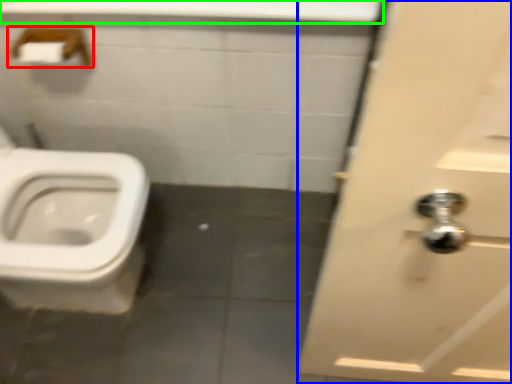
Question: Based on their relative distances, which object is farther from towel bar (highlighted by a red box)? Choose from door (highlighted by a blue box) and counter top (highlighted by a green box).

Choices:
 (A) door
 (B) counter top

Answer: (A)